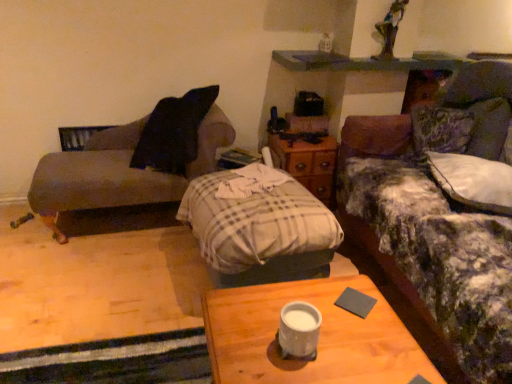
This screenshot has height=384, width=512. Identify the location of free spot in front of gray matte pad at center. (367, 343).